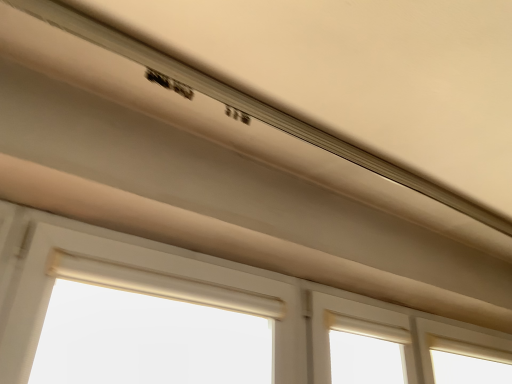
Question: Does point tap(360, 150) appear closer or farther from the camera than point tap(103, 299)?

Choices:
 (A) farther
 (B) closer

Answer: (A)

Question: In the image, is matte white exhaust hood at upper center on the left side or the right side of beige fabric curtain at lower center?

Choices:
 (A) right
 (B) left

Answer: (A)

Question: Estimate the real-world distances between objects in this image. Which object is farther from the beige fabric curtain at lower center?

Choices:
 (A) white matte window at center
 (B) matte white exhaust hood at upper center

Answer: (B)

Question: Which of these objects is positioned closest to the matte white exhaust hood at upper center?

Choices:
 (A) beige fabric curtain at lower center
 (B) white matte window at center

Answer: (B)